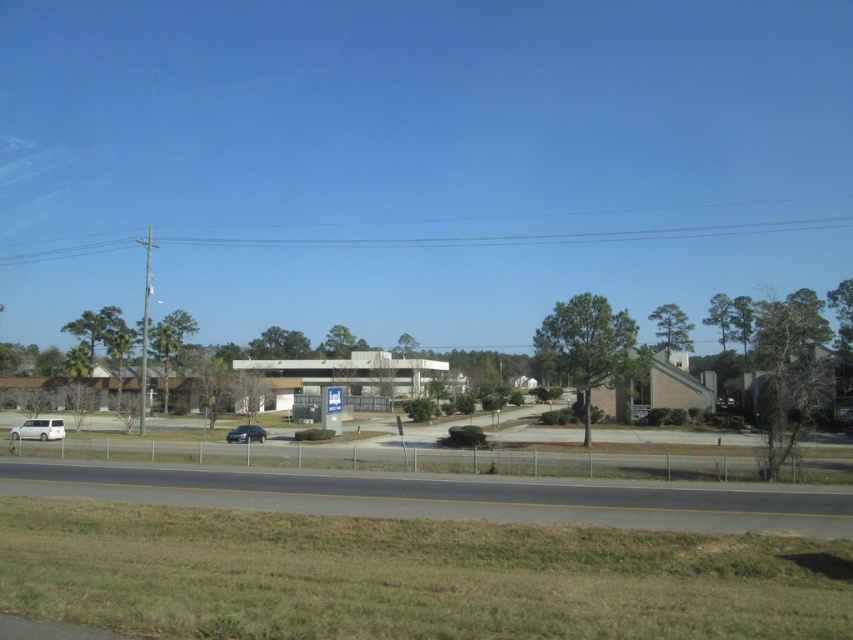
You are a pedestrian standing at the edge of the road in the suburban scene. You see the white matte van at lower left and the satin black sedan at lower left. Which vehicle is closer to you?

The white matte van at lower left is closer because it is positioned in front of the satin black sedan at lower left from your viewpoint.

A drone is flying at a height of 50 meters above the suburban scene. It needs to deliver a package to the point marked at point (48, 438). The drone has a maximum horizontal range of 50 meters. Can the drone reach the delivery point from its current position?

The distance between the drone and the delivery point is 54.08 meters, which exceeds the drone s maximum horizontal range of 50 meters. Therefore, the drone cannot reach the delivery point.